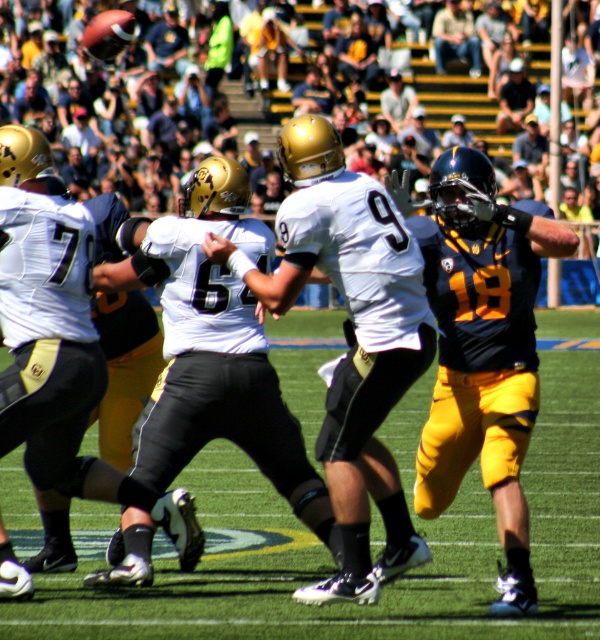
In the scene of the American football game, there are two central jerseys visible. Which one is positioned to the left when observing the white matte jersey at center and the dark blue jersey at center?

The white matte jersey at center is positioned to the left of the dark blue jersey at center.

You are a photographer standing on the sidelines of the football field. You notice two jerseys at the center of the field, the white matte jersey at center and the dark blue jersey at center. Which jersey would appear wider in your camera frame?

The white matte jersey at center appears wider than the dark blue jersey at center because its width is larger according to the description.

You are a referee standing at the edge of the field. You need to ensure that the two players wearing matte white jersey at center and white matte jersey at center are not too close to each other. According to the rulebook, players must be at least 2 meters apart during the formation. Are they compliant with the rule?

The distance between the matte white jersey at center and the white matte jersey at center is 1.25 meters, which is less than the required 2 meters. Therefore, they are not compliant with the rule.